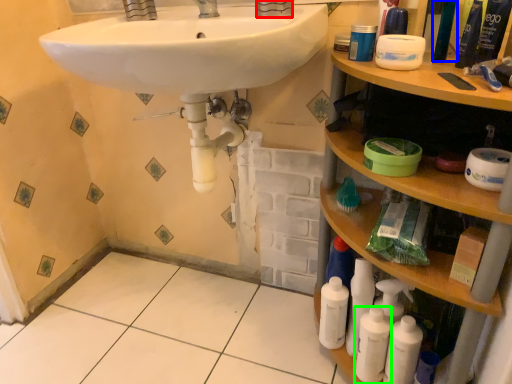
Question: Considering the real-world distances, which object is closest to faucet (highlighted by a red box)? mouthwash (highlighted by a blue box) or cleaning product (highlighted by a green box).

Choices:
 (A) mouthwash
 (B) cleaning product

Answer: (A)